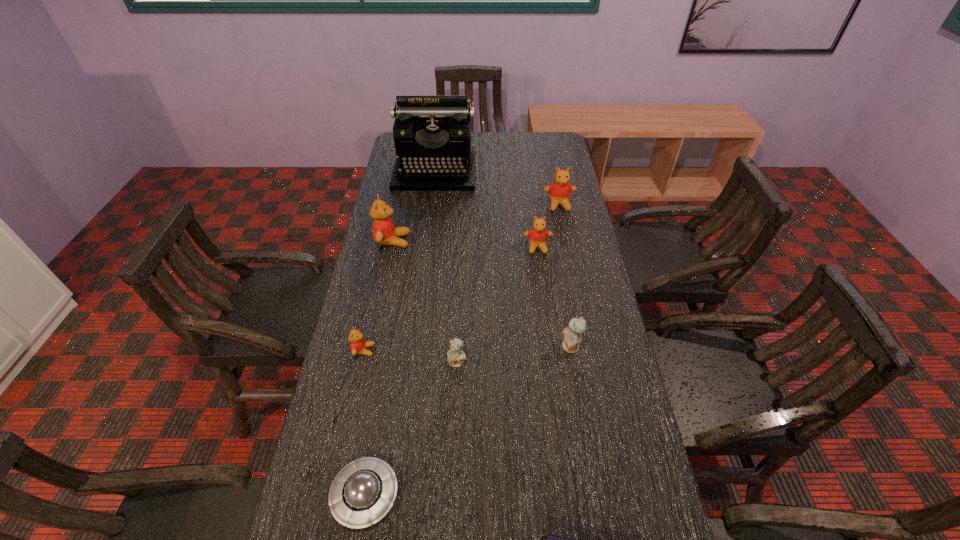
You are a GUI agent. You are given a task and a screenshot of the screen. Output one action in this format:
    pyautogui.click(x=<x>, y=<y>)
    Task: Click on the free point between the tallest teddy bear and the smaller blue teddy bear
    Image resolution: width=960 pixels, height=540 pixels.
    Given the screenshot: What is the action you would take?
    pyautogui.click(x=425, y=301)

You are a GUI agent. You are given a task and a screenshot of the screen. Output one action in this format:
    pyautogui.click(x=<x>, y=<y>)
    Task: Click on the free space between the left blue teddy bear and the second smallest red teddy bear
    This screenshot has height=540, width=960.
    Given the screenshot: What is the action you would take?
    pyautogui.click(x=497, y=305)

Locate an element on the screen. Image resolution: width=960 pixels, height=540 pixels. free point between the smaller blue teddy bear and the farthest red teddy bear is located at coordinates (x=508, y=284).

Where is `vacant region between the second tallest object and the second nearest object`? The image size is (960, 540). vacant region between the second tallest object and the second nearest object is located at coordinates (379, 368).

At what (x,y) coordinates should I click in order to perform the action: click on vacant space that's between the tallest object and the third biggest red teddy bear. Please return your answer as a coordinate pair (x, y). This screenshot has width=960, height=540. Looking at the image, I should click on (487, 209).

This screenshot has height=540, width=960. Identify the location of free point between the smallest red teddy bear and the second biggest red teddy bear. (462, 278).

The image size is (960, 540). I want to click on free spot between the smallest red teddy bear and the biggest red teddy bear, so click(x=378, y=295).

This screenshot has width=960, height=540. I want to click on vacant area that lies between the saucer and the smaller blue teddy bear, so click(x=411, y=428).

Locate an element on the screen. free spot between the typewriter and the saucer is located at coordinates (400, 333).

Find the location of `free space between the smaller blue teddy bear and the right blue teddy bear`. free space between the smaller blue teddy bear and the right blue teddy bear is located at coordinates (514, 354).